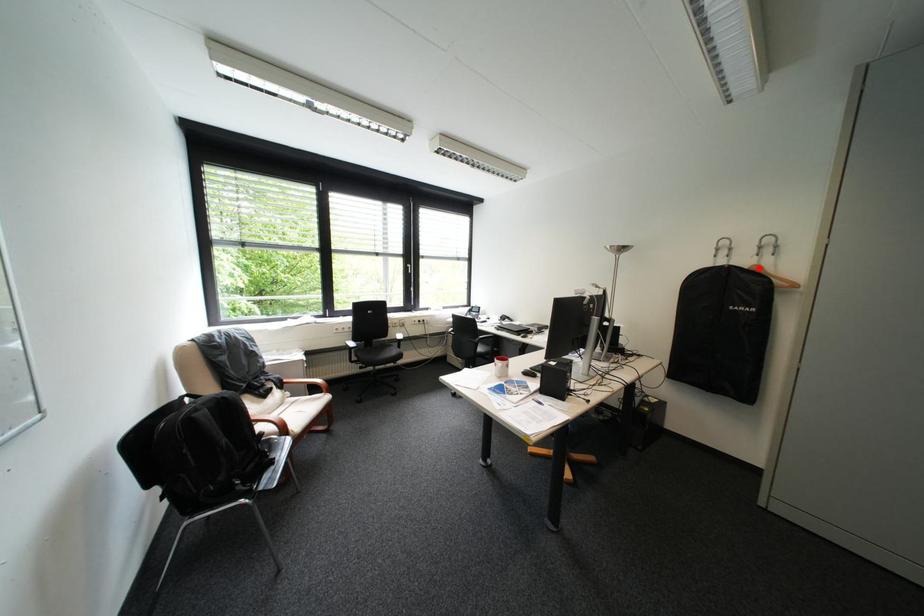
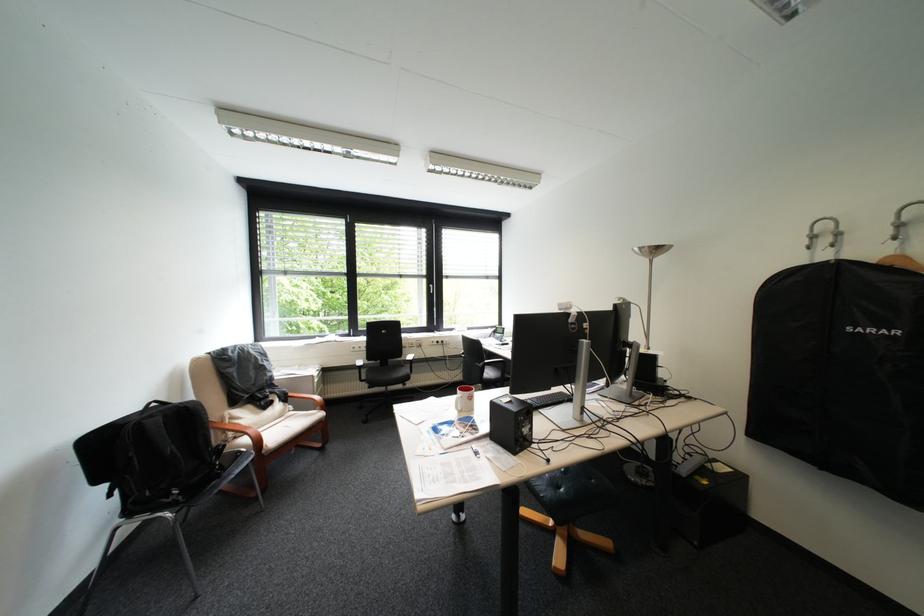
Find the pixel in the second image that matches the highlighted location in the first image.

(886, 262)